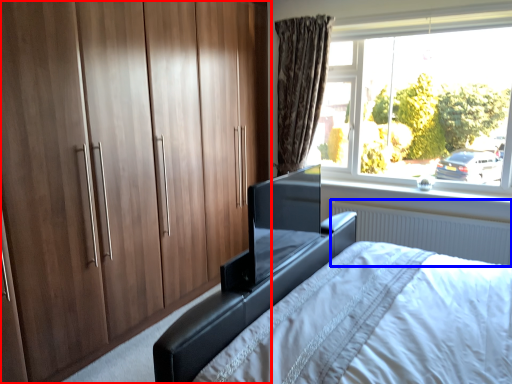
Question: Which point is further to the camera, cupboard (highlighted by a red box) or radiator (highlighted by a blue box)?

Choices:
 (A) cupboard
 (B) radiator

Answer: (B)